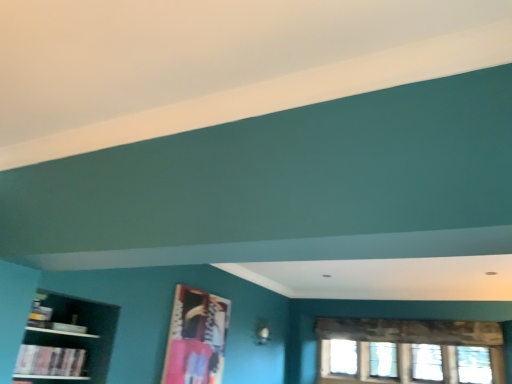
At what (x,y) coordinates should I click in order to perform the action: click on empty space that is ontop of hardcover book at lower left (from a real-world perspective). Please return your answer as a coordinate pair (x, y). Image resolution: width=512 pixels, height=384 pixels. Looking at the image, I should click on (54, 346).